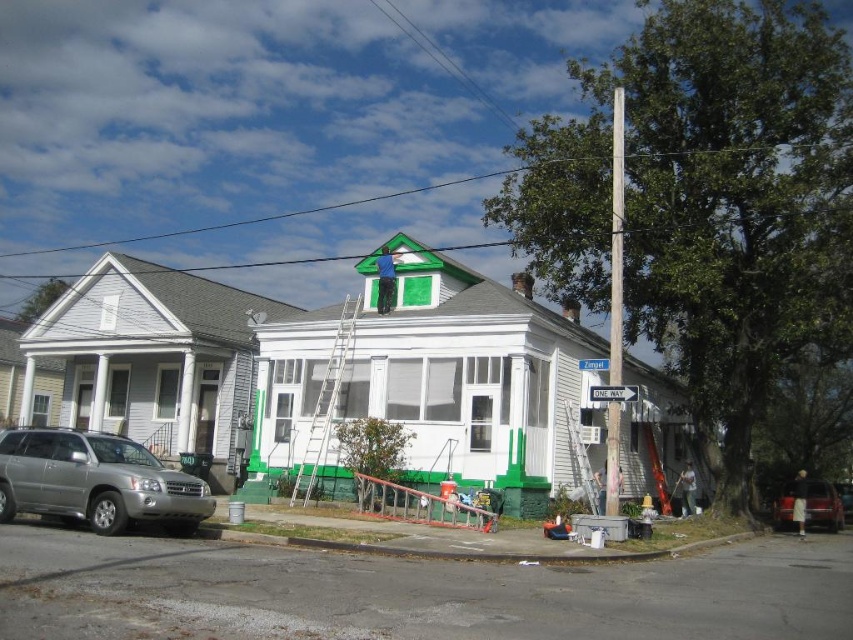
You are standing at the center of the street looking at the two houses. Where is the smooth wood pole at right located in relation to the houses?

The smooth wood pole at right is located at the coordinates point (616, 237).

In the scene shown: You are a delivery person standing at the point with coordinates point (618,326) and need to deliver a package to the point with coordinates point (606,362). Given that you can only move forward and cannot move backward, will you be able to reach the destination without turning around?

Since point (618,326) is in front of point (606,362), you are already at a position that is ahead of the destination. Therefore, you will need to move backward to reach the destination, which is not allowed. Unfortunately, you cannot deliver the package without turning around.